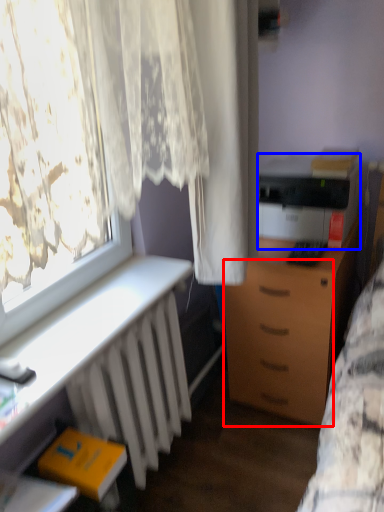
Question: Among these objects, which one is nearest to the camera, drawer (highlighted by a red box) or printer (highlighted by a blue box)?

Choices:
 (A) drawer
 (B) printer

Answer: (A)